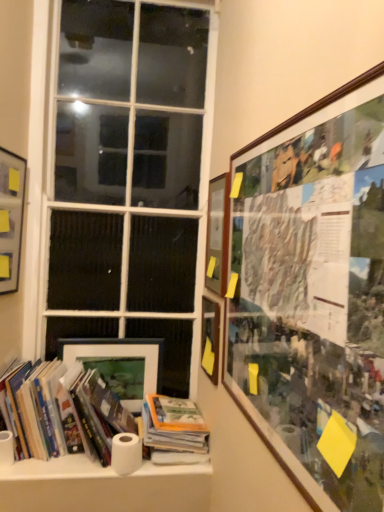
Where is `vacant area that lies between white matte paper towel at lower left and white matte toilet paper at lower center`? The width and height of the screenshot is (384, 512). vacant area that lies between white matte paper towel at lower left and white matte toilet paper at lower center is located at coordinates (66, 466).